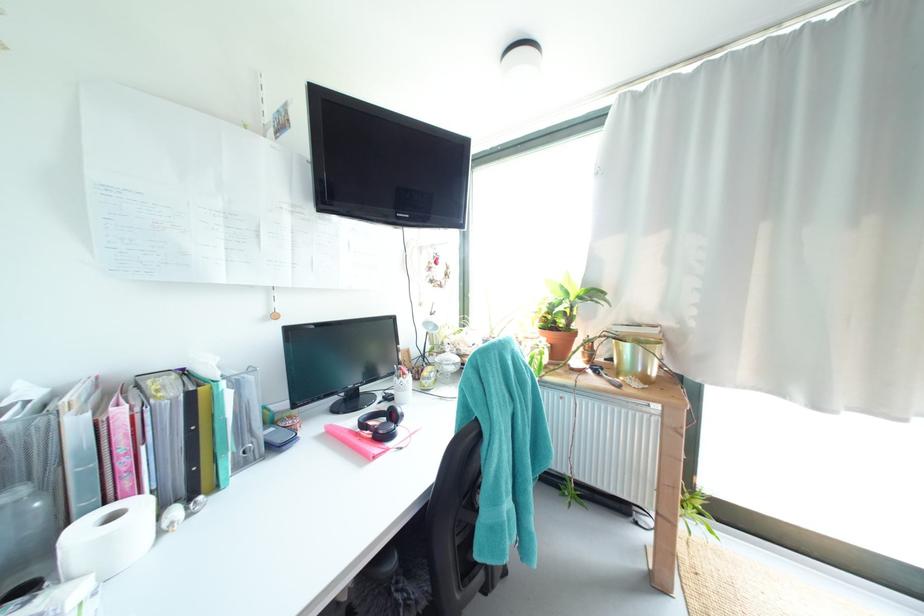
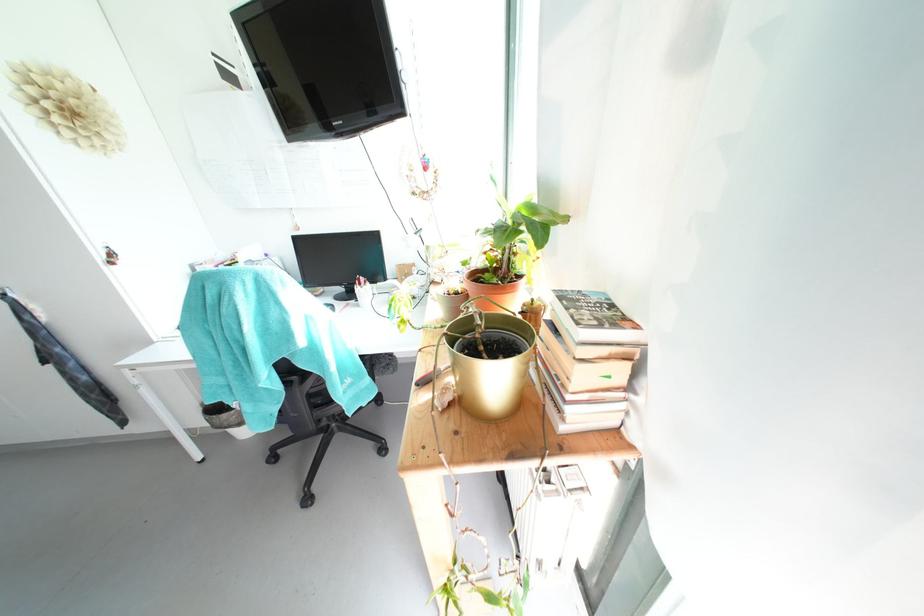
In the second image, find the point that corresponds to pixel 407 379 in the first image.

(362, 286)